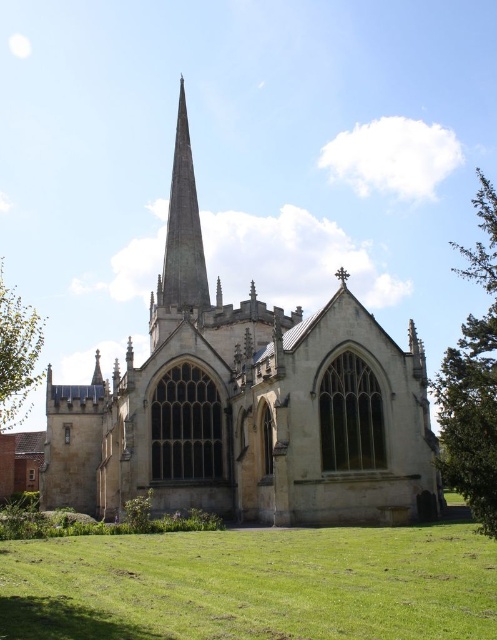
You are standing at the entrance of the historic stone church and want to walk towards the green leafy tree at lower left. Which direction should you walk to avoid stepping on the green grass at lower center?

To avoid stepping on the green grass at lower center, walk towards the green leafy tree at lower left while staying to the left side since the green grass at lower center is wider than the green leafy tree at lower left.

Consider the image. You are standing in front of the historic stone church and notice a point marked at coordinates (473, 380). Based on the church description, what object is located at that point?

The point at coordinates (473, 380) indicates a green leafy tree at right.